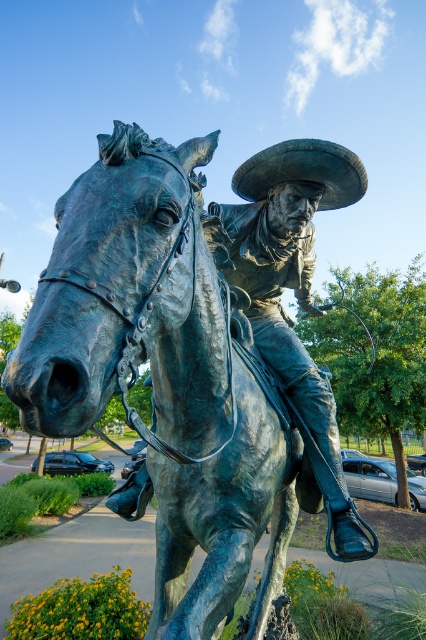
Question: Is bronze statue of horse at center thinner than bronze statue at center?

Choices:
 (A) yes
 (B) no

Answer: (B)

Question: Which point is closer to the camera?

Choices:
 (A) bronze textured cowboy hat at center
 (B) bronze statue of horse at center

Answer: (B)

Question: Estimate the real-world distances between objects in this image. Which object is closer to the bronze textured cowboy hat at center?

Choices:
 (A) bronze statue at center
 (B) bronze statue of horse at center

Answer: (A)

Question: Which object is the farthest from the bronze textured cowboy hat at center?

Choices:
 (A) bronze statue of horse at center
 (B) bronze statue at center

Answer: (A)

Question: Is bronze statue of horse at center wider than bronze statue at center?

Choices:
 (A) no
 (B) yes

Answer: (B)

Question: Is bronze statue at center smaller than bronze textured cowboy hat at center?

Choices:
 (A) yes
 (B) no

Answer: (B)